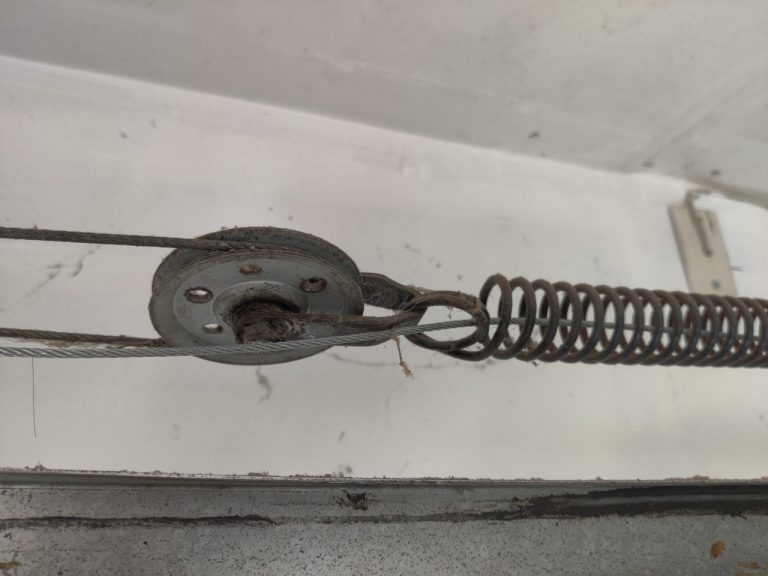
What are the coordinates of `picture` in the screenshot? It's located at (x=445, y=215).